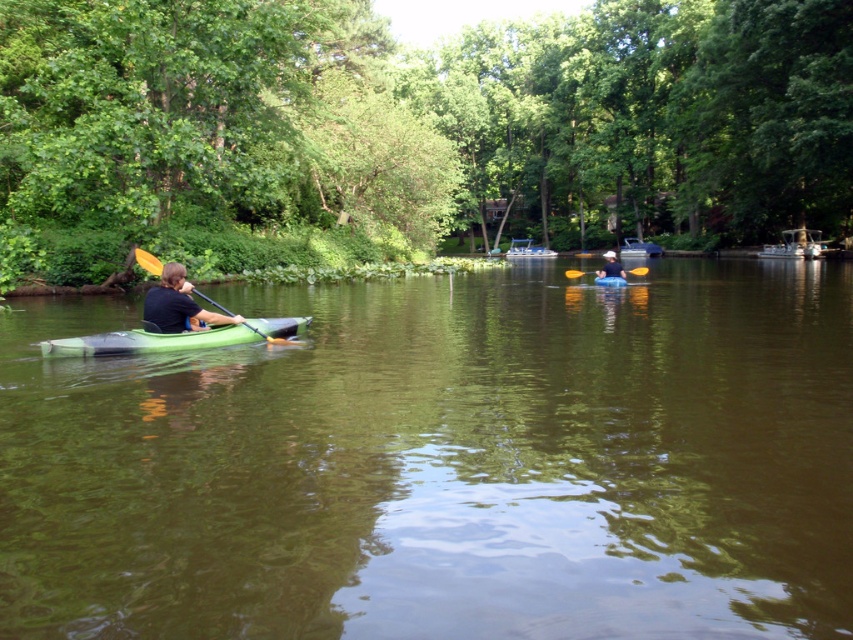
Question: Which object is the closest to the yellow plastic paddle at center?

Choices:
 (A) blue rubber canoe at center
 (B) green rubber kayak at left

Answer: (A)

Question: In this image, where is matte green kayak at left located relative to yellow wood paddle at left?

Choices:
 (A) below
 (B) above

Answer: (A)

Question: Is the position of yellow wood paddle at left less distant than that of white matte kayak at center?

Choices:
 (A) no
 (B) yes

Answer: (B)

Question: Considering the real-world distances, which object is closest to the blue rubber canoe at center?

Choices:
 (A) yellow plastic paddle at center
 (B) green matte kayak at left
 (C) white matte kayak at center

Answer: (C)

Question: Does matte green kayak at left have a larger size compared to white matte kayak at center?

Choices:
 (A) yes
 (B) no

Answer: (B)

Question: Which object is closer to the camera taking this photo?

Choices:
 (A) green matte kayak at left
 (B) white matte kayak at center
 (C) matte green kayak at left

Answer: (C)